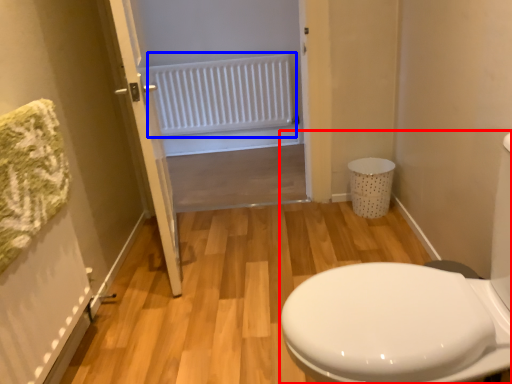
Question: Which of the following is the farthest to the observer, porcelain (highlighted by a red box) or radiator (highlighted by a blue box)?

Choices:
 (A) porcelain
 (B) radiator

Answer: (B)